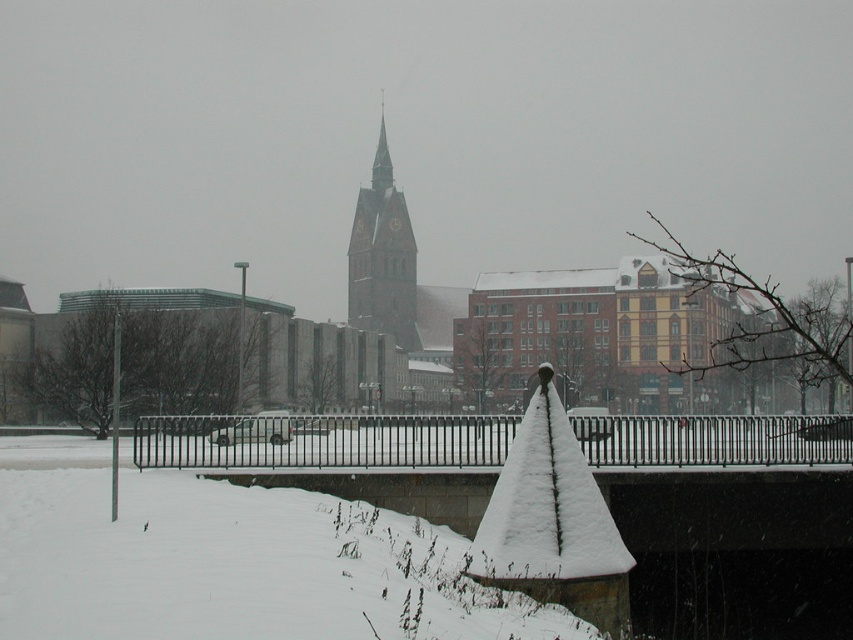
You are a delivery person trying to navigate through the snow in this winter scene. You see the black metal fence at center and the brown stone clock tower at center. Which object is closer to you?

The black metal fence at center is smaller than the brown stone clock tower at center, so the black metal fence at center is closer to you because smaller objects in the foreground appear smaller than larger ones in the background.

Based on the photo, you are standing at the center of the image and see the point marked at coordinates (724, 480). What object is located at that point?

The point at coordinates (724, 480) marks the location of the black metal fence at center.

You are a delivery person trying to deliver a package to the brown stone clock tower at center. You are currently standing behind the black metal fence at center. Can you walk directly to the tower without going around the fence?

The black metal fence at center is in front of the brown stone clock tower at center, so you cannot walk directly to the tower without going around the fence.